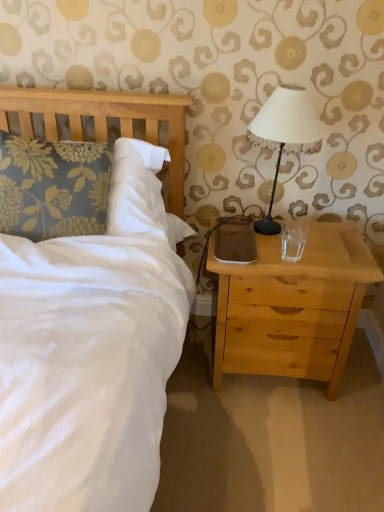
Question: Is white fabric-covered lampshade at upper right located outside transparent glass at right?

Choices:
 (A) yes
 (B) no

Answer: (A)

Question: Is white fabric-covered lampshade at upper right bigger than transparent glass at right?

Choices:
 (A) no
 (B) yes

Answer: (B)

Question: Does white fabric-covered lampshade at upper right come behind transparent glass at right?

Choices:
 (A) yes
 (B) no

Answer: (B)

Question: Is white fabric-covered lampshade at upper right wider than transparent glass at right?

Choices:
 (A) no
 (B) yes

Answer: (B)

Question: Does white fabric-covered lampshade at upper right contain transparent glass at right?

Choices:
 (A) no
 (B) yes

Answer: (A)

Question: Considering the relative sizes of white fabric-covered lampshade at upper right and transparent glass at right in the image provided, is white fabric-covered lampshade at upper right smaller than transparent glass at right?

Choices:
 (A) no
 (B) yes

Answer: (A)

Question: From the image's perspective, would you say white fabric-covered lampshade at upper right is shown under light wood nightstand at right?

Choices:
 (A) no
 (B) yes

Answer: (A)

Question: Considering the relative positions of white fabric-covered lampshade at upper right and light wood nightstand at right in the image provided, is white fabric-covered lampshade at upper right in front of light wood nightstand at right?

Choices:
 (A) no
 (B) yes

Answer: (B)

Question: Is white fabric-covered lampshade at upper right at the left side of light wood nightstand at right?

Choices:
 (A) no
 (B) yes

Answer: (B)

Question: Could you tell me if white fabric-covered lampshade at upper right is facing light wood nightstand at right?

Choices:
 (A) no
 (B) yes

Answer: (A)

Question: Is white fabric-covered lampshade at upper right further to the viewer compared to light wood nightstand at right?

Choices:
 (A) yes
 (B) no

Answer: (B)

Question: Can light wood nightstand at right be found inside white fabric-covered lampshade at upper right?

Choices:
 (A) yes
 (B) no

Answer: (B)

Question: Is floral fabric pillow at left not close to light wood nightstand at right?

Choices:
 (A) no
 (B) yes

Answer: (A)